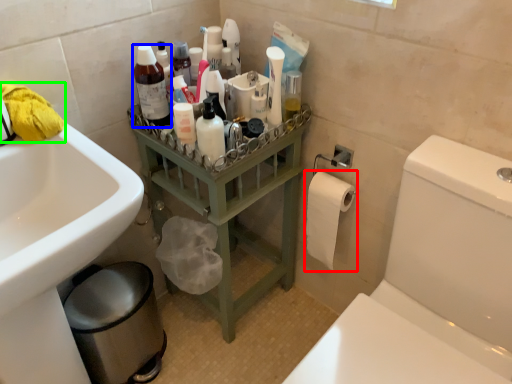
Question: Based on their relative distances, which object is nearer to toilet paper (highlighted by a red box)? Choose from cleaning product (highlighted by a blue box) and material (highlighted by a green box).

Choices:
 (A) cleaning product
 (B) material

Answer: (A)